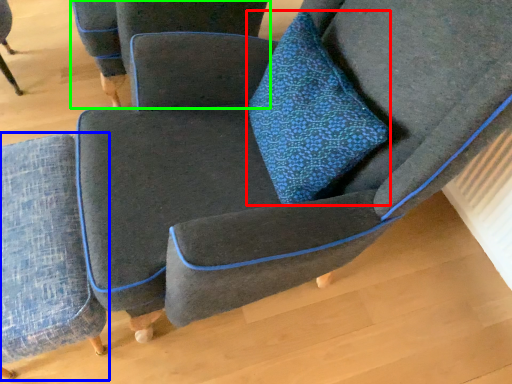
Question: Based on their relative distances, which object is farther from throw pillow (highlighted by a red box)? Choose from chair (highlighted by a blue box) and chair (highlighted by a green box).

Choices:
 (A) chair
 (B) chair

Answer: (B)